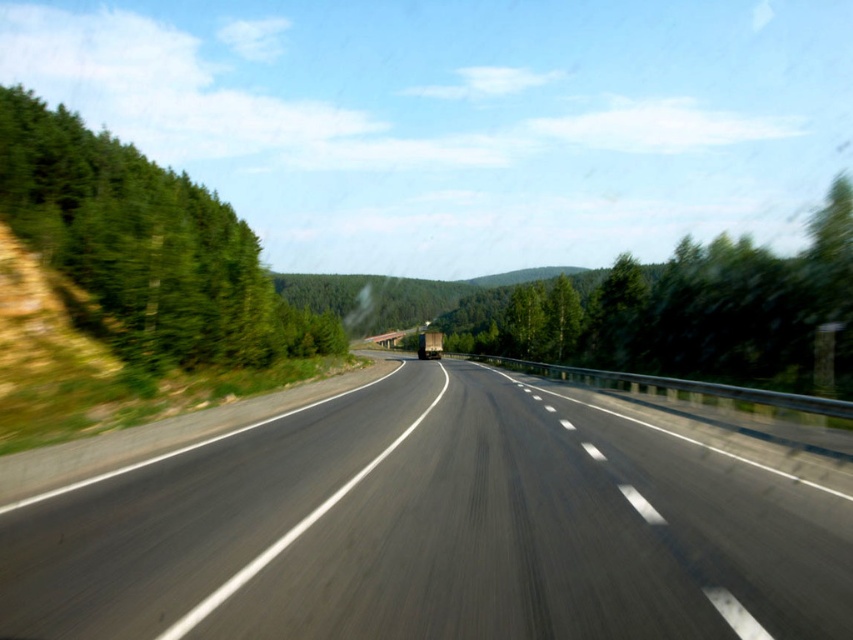
Question: Is black asphalt highway at center thinner than green leafy trees at left?

Choices:
 (A) yes
 (B) no

Answer: (A)

Question: Can you confirm if black asphalt highway at center is wider than green leafy tree at center?

Choices:
 (A) no
 (B) yes

Answer: (A)

Question: Does black asphalt highway at center appear under green leafy tree at center?

Choices:
 (A) yes
 (B) no

Answer: (A)

Question: Which point is farther to the camera?

Choices:
 (A) (86, 237)
 (B) (679, 616)

Answer: (A)

Question: Which of the following is the closest to the observer?

Choices:
 (A) black asphalt highway at center
 (B) green leafy trees at left
 (C) green leafy tree at center

Answer: (A)

Question: Which point is farther from the camera taking this photo?

Choices:
 (A) (120, 604)
 (B) (48, 125)
 (C) (560, 330)

Answer: (C)